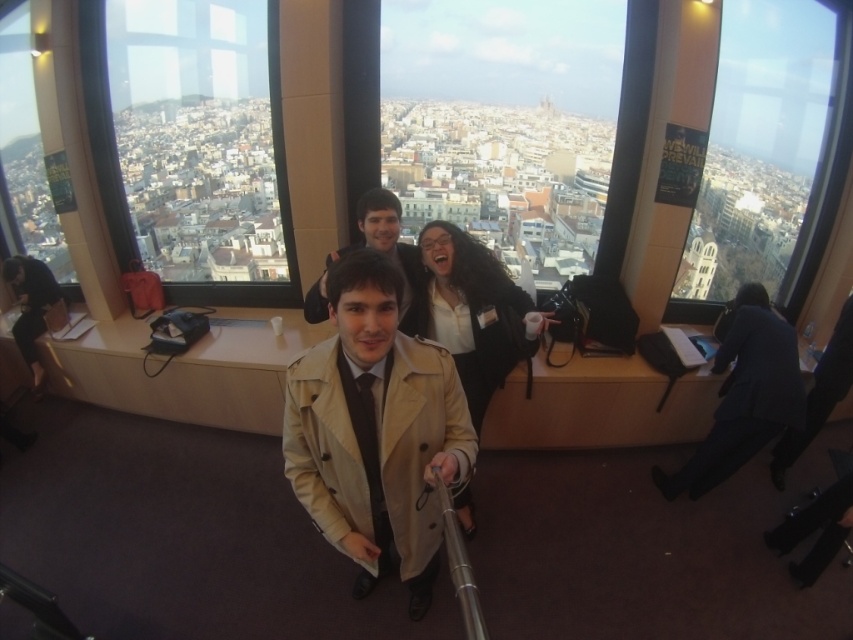
Who is higher up, transparent glass window at upper right or dark blue suit at right?

transparent glass window at upper right is above.

Does point (793, 45) lie in front of point (775, 358)?

No, (793, 45) is further to viewer.

Is point (834, 129) positioned after point (733, 307)?

Yes, point (834, 129) is farther from viewer.

Identify the location of transparent glass window at upper right. (770, 154).

Which of these two, transparent glass window at upper right or dark brown leather jacket at left, stands taller?

With more height is transparent glass window at upper right.

Is transparent glass window at upper right wider than dark brown leather jacket at left?

Yes.

Does point (776, 195) lie behind point (15, 324)?

Yes, it is behind point (15, 324).

This screenshot has width=853, height=640. Identify the location of transparent glass window at upper right. (770, 154).

Does transparent glass window at upper right appear over light beige trench coat at center?

Correct, transparent glass window at upper right is located above light beige trench coat at center.

Does point (782, 264) come in front of point (399, 312)?

No, it is behind (399, 312).

Where is `transparent glass window at upper right`? transparent glass window at upper right is located at coordinates (770, 154).